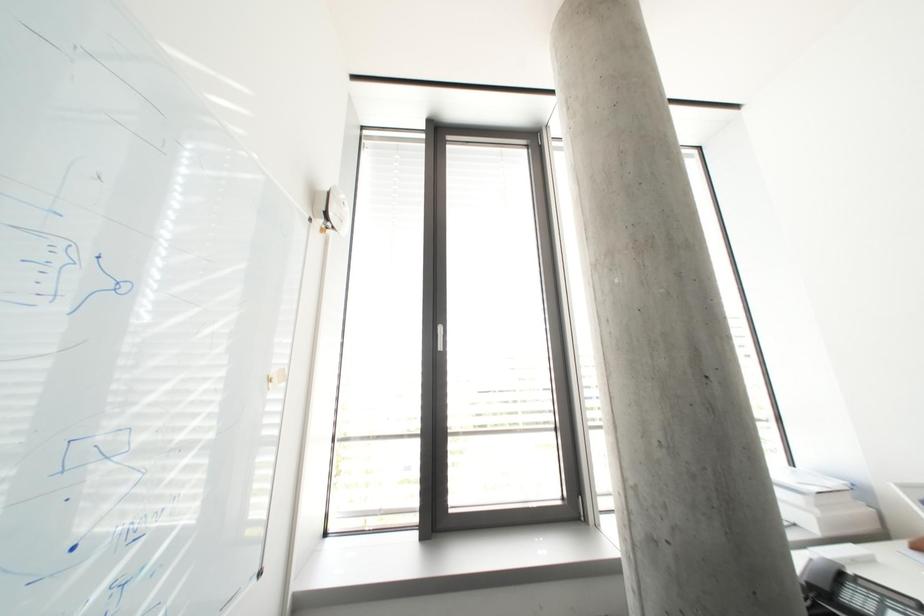
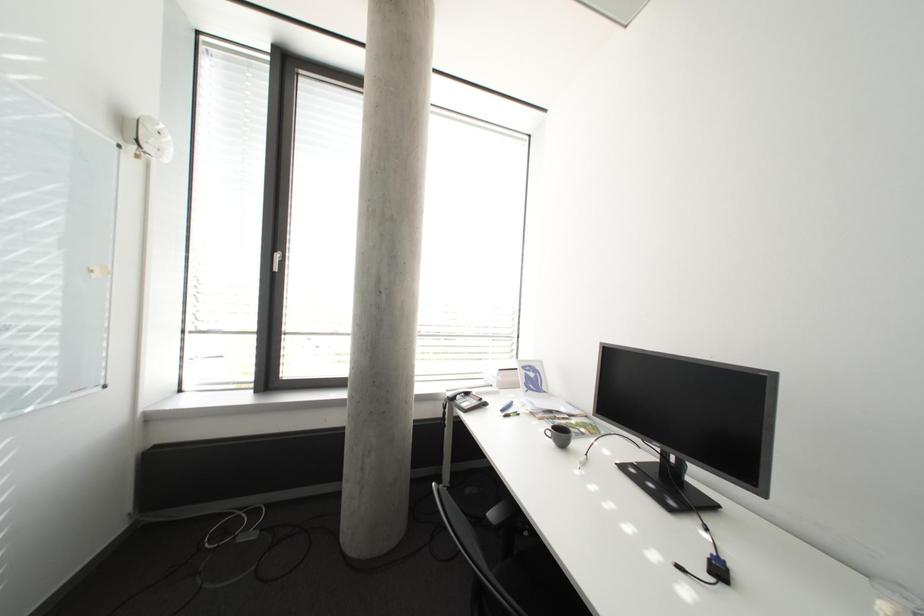
In a continuous first-person perspective shot, in which direction is the camera moving?

The cameraman walked toward right, backward.